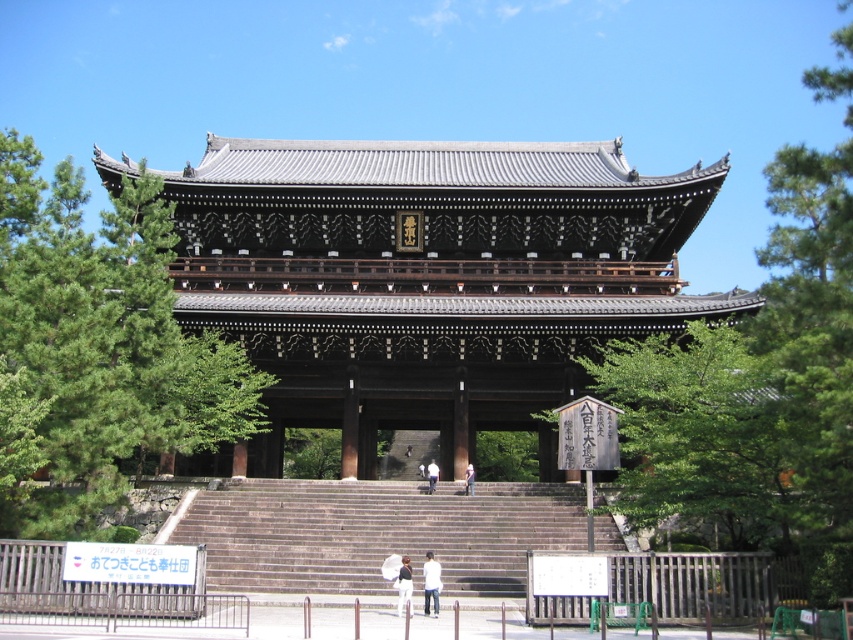
Question: Which of the following is the farthest from the observer?

Choices:
 (A) dark brown stone stairs at center
 (B) white cotton pants at center
 (C) light brown wooden person at center
 (D) green leafy tree at left

Answer: (C)

Question: Is dark brown stone stairs at center below white matte person at center?

Choices:
 (A) yes
 (B) no

Answer: (B)

Question: Which object is the closest to the green leafy tree at upper right?

Choices:
 (A) white matte person at center
 (B) light brown wooden person at center
 (C) white cotton shirt at center

Answer: (C)

Question: Observing the image, what is the correct spatial positioning of green leafy tree at upper right in reference to white matte person at center?

Choices:
 (A) right
 (B) left

Answer: (A)

Question: Is white cotton shirt at center positioned before white matte person at center?

Choices:
 (A) no
 (B) yes

Answer: (B)

Question: Among these points, which one is farthest from the camera?

Choices:
 (A) (450, 502)
 (B) (466, 481)

Answer: (B)